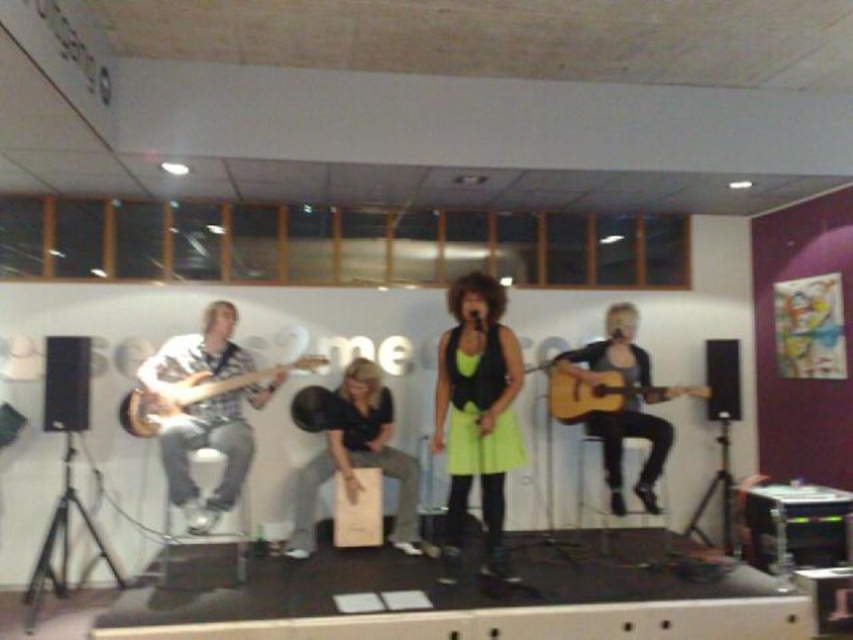
Who is more forward, (486,332) or (456,436)?

Point (486,332) is more forward.

Does matte black guitar at left appear on the left side of neon yellow dress at center?

Yes, matte black guitar at left is to the left of neon yellow dress at center.

Identify the location of matte black guitar at left. (479, 406).

Looking at this image, can you confirm if neon yellow dress at center is bigger than acoustic wood guitar at center?

Yes, neon yellow dress at center is bigger than acoustic wood guitar at center.

Looking at this image, is neon yellow dress at center behind acoustic wood guitar at center?

No.

Is point (463, 477) farther from viewer compared to point (558, 384)?

No, (463, 477) is in front of (558, 384).

Locate an element on the screen. The height and width of the screenshot is (640, 853). neon yellow dress at center is located at coordinates (477, 416).

Which is more to the left, matte black guitar at left or acoustic wood guitar at center?

matte black guitar at left

Which is behind, point (490, 280) or point (598, 394)?

Point (598, 394)

Where is `matte black guitar at left`? This screenshot has height=640, width=853. matte black guitar at left is located at coordinates (479, 406).